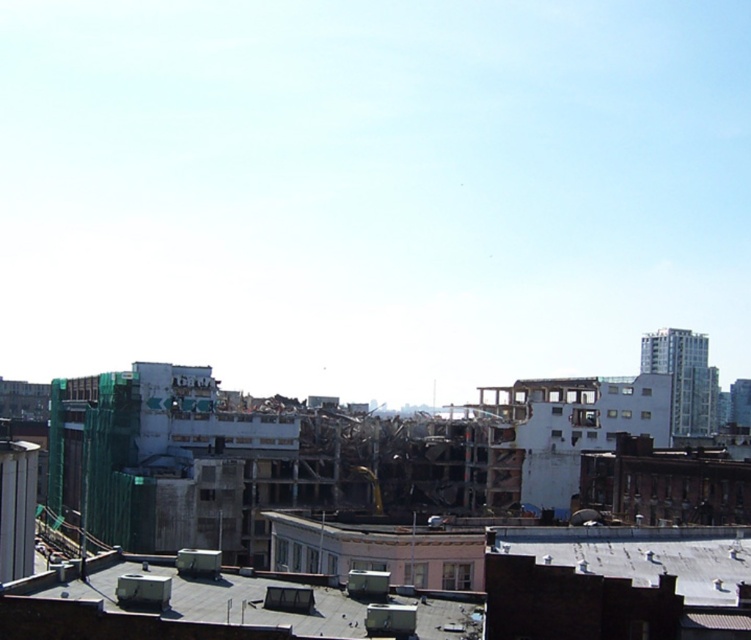
You are a construction worker assessing the site. You need to determine if the concrete rubble at center can be moved to the gray concrete roof at lower center without exceeding its width. Can it fit?

The concrete rubble at center is wider than the gray concrete roof at lower center, so it cannot fit on the roof without exceeding its width.

Consider the image. You are a construction worker assessing the site. You see the concrete rubble at center and the gray concrete roof at lower center. Which object is higher in elevation?

The concrete rubble at center is taller than the gray concrete roof at lower center, so the concrete rubble at center is higher in elevation.